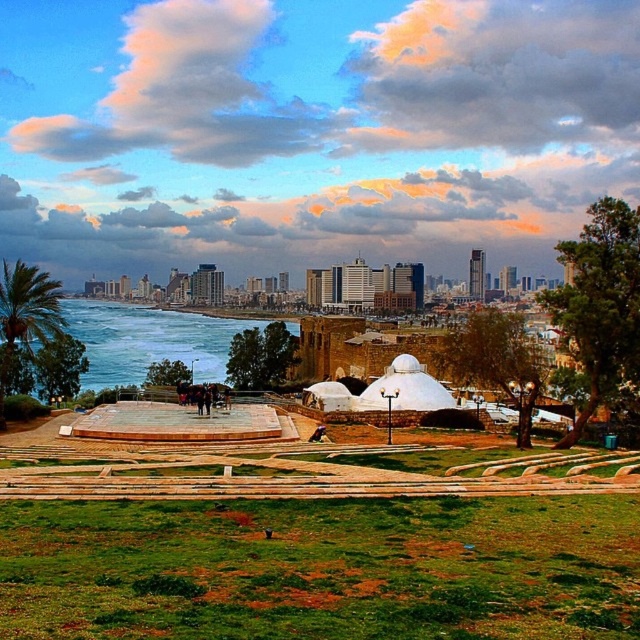
You are a tourist standing on the grassy area with dry soil patches. You want to take a photo that includes both the blue ocean water at lower left and the green leafy palm tree at left. Which object should you frame first in your camera to ensure both are visible?

Since the blue ocean water at lower left is larger in size compared to the green leafy palm tree at left, you should frame the blue ocean water at lower left first as it takes up more space in the scene, allowing the smaller green leafy palm tree at left to fit into the frame more easily.

In the scene shown: You are standing at the center of the plaza in the coastal cityscape. You want to get to the blue ocean water at lower left. Which direction should you walk?

You should walk towards the lower left direction to reach the blue ocean water at lower left.